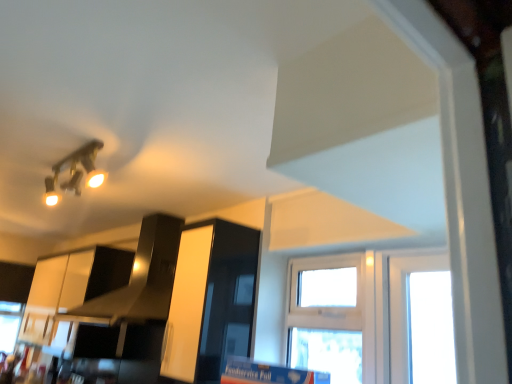
Find the location of a particular element. The image size is (512, 384). matte gold light fixture at upper left is located at coordinates (75, 172).

The image size is (512, 384). What do you see at coordinates (140, 278) in the screenshot? I see `black glossy exhaust hood at upper center` at bounding box center [140, 278].

Locate an element on the screen. glossy white cabinet at center is located at coordinates (210, 301).

Find the location of a particular element. The height and width of the screenshot is (384, 512). matte gold light fixture at upper left is located at coordinates (x=75, y=172).

Would you say black glossy exhaust hood at upper center is outside white plastic window at center?

Yes, black glossy exhaust hood at upper center is outside of white plastic window at center.

Would you say black glossy exhaust hood at upper center is a long distance from white plastic window at center?

No.

Between black glossy exhaust hood at upper center and white plastic window at center, which one has larger size?

With larger size is black glossy exhaust hood at upper center.

Based on the photo, is black glossy exhaust hood at upper center turned away from white plastic window at center?

No, white plastic window at center is not at the back of black glossy exhaust hood at upper center.

You are a GUI agent. You are given a task and a screenshot of the screen. Output one action in this format:
    pyautogui.click(x=<x>, y=<y>)
    Task: Click on the exhaust hood on the left of glossy white cabinet at center
    
    Given the screenshot: What is the action you would take?
    pyautogui.click(x=140, y=278)

How many degrees apart are the facing directions of glossy white cabinet at center and black glossy exhaust hood at upper center?

glossy white cabinet at center and black glossy exhaust hood at upper center are facing 4.24 degrees away from each other.

Considering the relative sizes of glossy white cabinet at center and black glossy exhaust hood at upper center in the image provided, is glossy white cabinet at center wider than black glossy exhaust hood at upper center?

No, glossy white cabinet at center is not wider than black glossy exhaust hood at upper center.

From the image's perspective, is glossy white cabinet at center located above or below black glossy exhaust hood at upper center?

glossy white cabinet at center is below black glossy exhaust hood at upper center.

Is glossy white cabinet at center positioned beyond the bounds of matte gold light fixture at upper left?

Indeed, glossy white cabinet at center is completely outside matte gold light fixture at upper left.

Is glossy white cabinet at center to the right of matte gold light fixture at upper left from the viewer's perspective?

Yes.

From the picture: Could you tell me if glossy white cabinet at center is facing matte gold light fixture at upper left?

Yes, glossy white cabinet at center is oriented towards matte gold light fixture at upper left.

How different are the orientations of matte gold light fixture at upper left and glossy white cabinet at center in degrees?

93.4 degrees separate the facing orientations of matte gold light fixture at upper left and glossy white cabinet at center.

In terms of width, does matte gold light fixture at upper left look wider or thinner when compared to glossy white cabinet at center?

Considering their sizes, matte gold light fixture at upper left looks broader than glossy white cabinet at center.

Could glossy white cabinet at center be considered to be inside matte gold light fixture at upper left?

That's incorrect, glossy white cabinet at center is not inside matte gold light fixture at upper left.

Can you confirm if matte gold light fixture at upper left is taller than glossy white cabinet at center?

No, matte gold light fixture at upper left is not taller than glossy white cabinet at center.

From a real-world perspective, does white plastic window at center stand above black glossy exhaust hood at upper center?

No.

Based on the photo, would you say white plastic window at center is inside or outside black glossy exhaust hood at upper center?

white plastic window at center is outside black glossy exhaust hood at upper center.

Which object is wider, white plastic window at center or black glossy exhaust hood at upper center?

Wider between the two is black glossy exhaust hood at upper center.

Find the location of a particular element. window below the black glossy exhaust hood at upper center (from a real-world perspective) is located at coordinates (328, 316).

Is white plastic window at center bigger than glossy white cabinet at center?

No.

Could you tell me if white plastic window at center is turned towards glossy white cabinet at center?

No, white plastic window at center is not facing towards glossy white cabinet at center.

From a real-world perspective, is white plastic window at center located higher than glossy white cabinet at center?

No, from a real-world perspective, white plastic window at center is not above glossy white cabinet at center.

Which of these two, white plastic window at center or glossy white cabinet at center, is wider?

Wider between the two is glossy white cabinet at center.

Which is more to the right, matte gold light fixture at upper left or black glossy exhaust hood at upper center?

black glossy exhaust hood at upper center is more to the right.

From the image's perspective, would you say matte gold light fixture at upper left is shown under black glossy exhaust hood at upper center?

No.

How many degrees apart are the facing directions of matte gold light fixture at upper left and black glossy exhaust hood at upper center?

89.2 degrees.

Based on the photo, is black glossy exhaust hood at upper center a part of matte gold light fixture at upper left?

No, black glossy exhaust hood at upper center is not a part of matte gold light fixture at upper left.

The height and width of the screenshot is (384, 512). In order to click on window located underneath the black glossy exhaust hood at upper center (from a real-world perspective) in this screenshot , I will do pos(328,316).

In order to click on exhaust hood behind the glossy white cabinet at center in this screenshot , I will do `click(140, 278)`.

When comparing their distances from glossy white cabinet at center, does black glossy exhaust hood at upper center or matte gold light fixture at upper left seem closer?

Based on the image, black glossy exhaust hood at upper center appears to be nearer to glossy white cabinet at center.

From the picture: From the image, which object appears to be farther from glossy white cabinet at center, white plastic window at center or matte gold light fixture at upper left?

matte gold light fixture at upper left.

Based on their spatial positions, is glossy white cabinet at center or white plastic window at center further from matte gold light fixture at upper left?

Among the two, white plastic window at center is located further to matte gold light fixture at upper left.

Estimate the real-world distances between objects in this image. Which object is further from black glossy exhaust hood at upper center, matte gold light fixture at upper left or glossy white cabinet at center?

matte gold light fixture at upper left is positioned further to the anchor black glossy exhaust hood at upper center.

Estimate the real-world distances between objects in this image. Which object is further from white plastic window at center, matte gold light fixture at upper left or glossy white cabinet at center?

matte gold light fixture at upper left is further to white plastic window at center.

Considering their positions, is black glossy exhaust hood at upper center positioned closer to white plastic window at center than glossy white cabinet at center?

Based on the image, glossy white cabinet at center appears to be nearer to white plastic window at center.

Looking at the image, which one is located closer to glossy white cabinet at center, black glossy exhaust hood at upper center or white plastic window at center?

The object closer to glossy white cabinet at center is black glossy exhaust hood at upper center.

Looking at the image, which one is located further to matte gold light fixture at upper left, white plastic window at center or black glossy exhaust hood at upper center?

white plastic window at center.

The height and width of the screenshot is (384, 512). Identify the location of exhaust hood between matte gold light fixture at upper left and white plastic window at center in the horizontal direction. (140, 278).

Locate an element on the screen. This screenshot has height=384, width=512. cabinetry located between black glossy exhaust hood at upper center and white plastic window at center in the left-right direction is located at coordinates (210, 301).

Locate an element on the screen. The width and height of the screenshot is (512, 384). exhaust hood that lies between matte gold light fixture at upper left and glossy white cabinet at center from top to bottom is located at coordinates (140, 278).

This screenshot has width=512, height=384. What are the coordinates of `cabinetry between matte gold light fixture at upper left and white plastic window at center from left to right` in the screenshot? It's located at (210, 301).